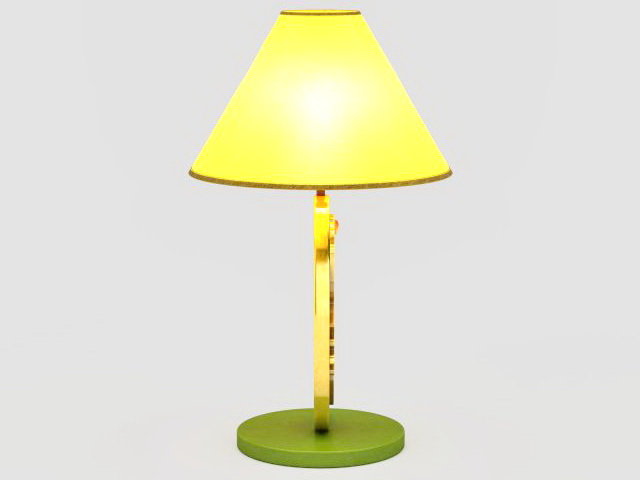
The image size is (640, 480). I want to click on light, so click(x=315, y=101).